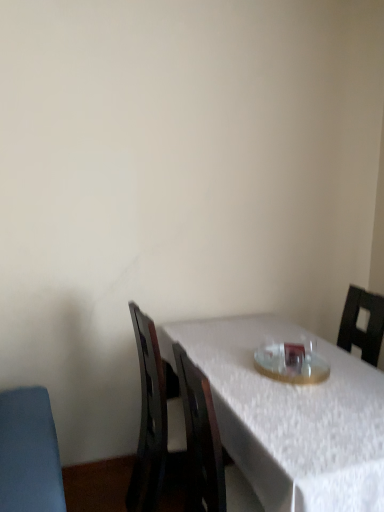
The height and width of the screenshot is (512, 384). Find the location of `vacant area to the right of clear glass plate at center`. vacant area to the right of clear glass plate at center is located at coordinates (351, 370).